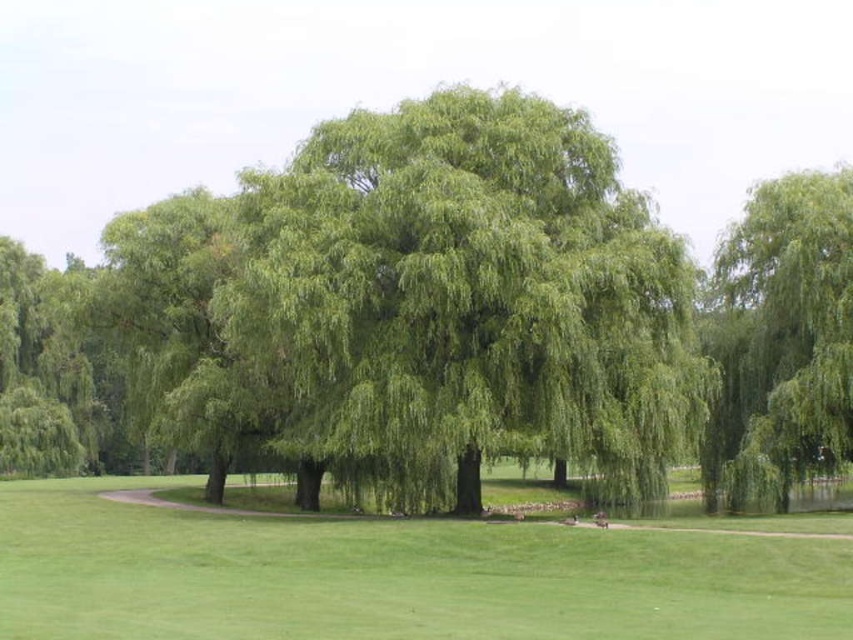
You are standing in the park and want to take a photo of both the green leafy willow at center and the green leafy willow at upper right. Which willow should you focus on first if you want to capture both in a single frame without moving your camera?

The green leafy willow at upper right should be focused on first because the green leafy willow at center is above it, so adjusting the camera angle to include both would require ensuring the lower positioned willow at upper right is within the frame first.

You are planning to set up a picnic blanket in the park. The picnic blanket is 2 meters wide. You see the green grass at center and the green leafy willow at upper right. Which area would you choose to place the blanket so that it fits entirely within the space provided?

The green grass at center has a larger width than the green leafy willow at upper right, so placing the picnic blanket on the green grass at center would ensure it fits entirely within the space.

You are standing at the center of the park and want to take a photo of the green leafy willow at center. Which direction should you face to ensure the tree is in the center of your camera view?

Since the green leafy willow at center is located at point (468,292), you should face slightly to the right and upward to center it in your camera view.